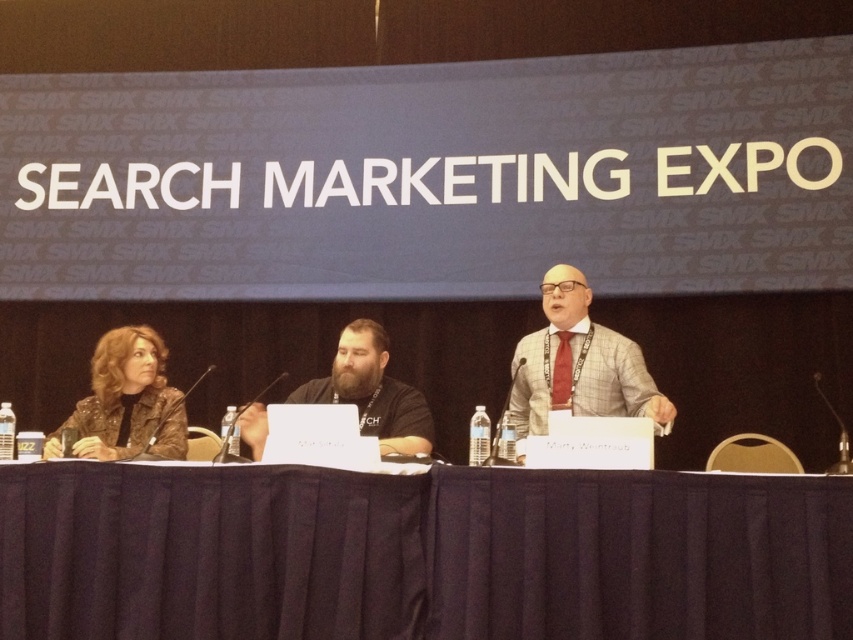
Is gray checkered suit at center taller than sparkly black jacket at left?

Indeed, gray checkered suit at center has a greater height compared to sparkly black jacket at left.

What do you see at coordinates (578, 364) in the screenshot?
I see `gray checkered suit at center` at bounding box center [578, 364].

Who is more distant from viewer, [599,392] or [128,448]?

The point [599,392] is behind.

The height and width of the screenshot is (640, 853). Identify the location of gray checkered suit at center. (578, 364).

Which is more to the right, sparkly black jacket at left or black matte shirt at center?

black matte shirt at center

Is sparkly black jacket at left smaller than black matte shirt at center?

Indeed, sparkly black jacket at left has a smaller size compared to black matte shirt at center.

Measure the distance between point [105,436] and camera.

Point [105,436] and camera are 5.69 meters apart.

Where is `sparkly black jacket at left`? sparkly black jacket at left is located at coordinates (126, 401).

Is black fabric table at center to the right of sparkly black jacket at left from the viewer's perspective?

Indeed, black fabric table at center is positioned on the right side of sparkly black jacket at left.

What do you see at coordinates (419, 554) in the screenshot? I see `black fabric table at center` at bounding box center [419, 554].

This screenshot has height=640, width=853. What do you see at coordinates (419, 554) in the screenshot? I see `black fabric table at center` at bounding box center [419, 554].

You are a GUI agent. You are given a task and a screenshot of the screen. Output one action in this format:
    pyautogui.click(x=<x>, y=<y>)
    Task: Click on the black fabric table at center
    
    Given the screenshot: What is the action you would take?
    pyautogui.click(x=419, y=554)